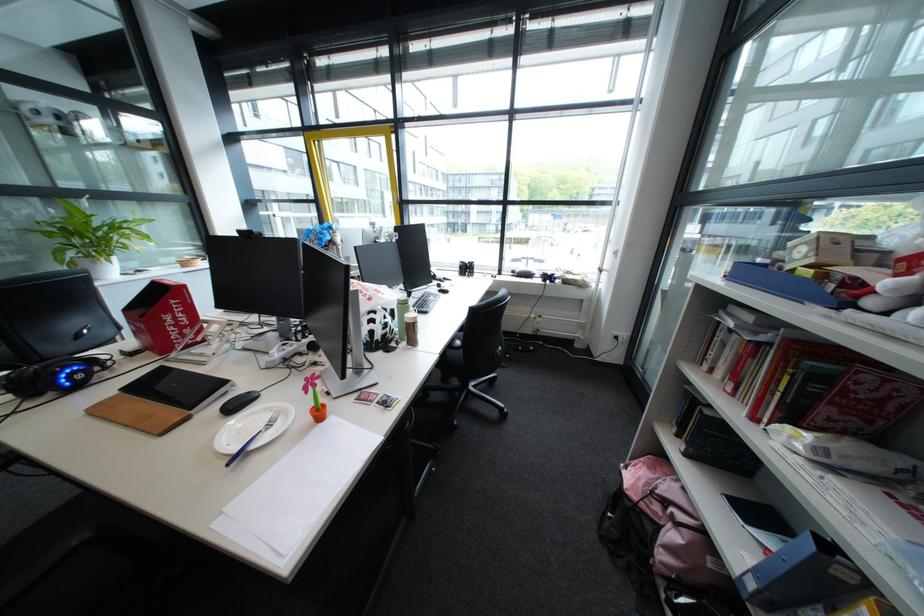
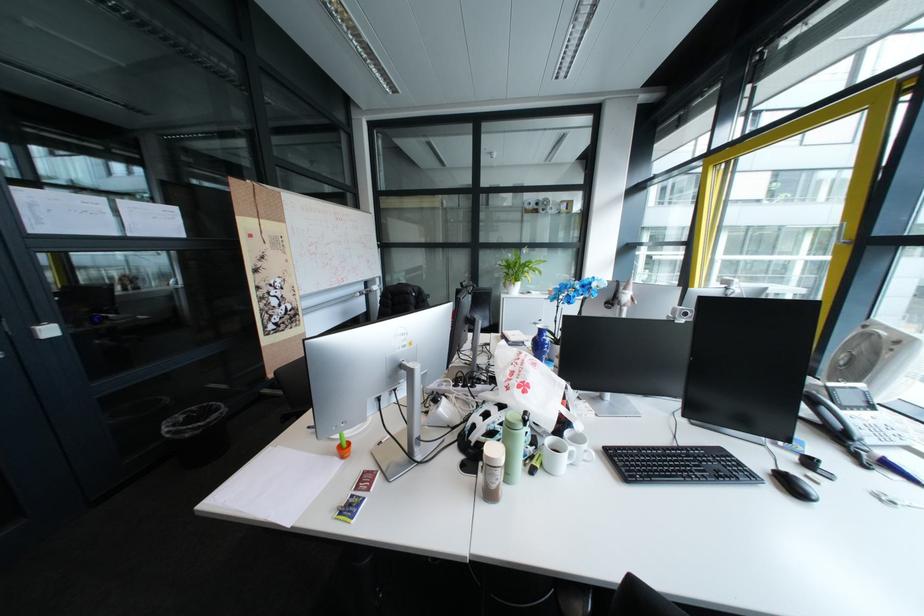
Where in the second image is the point corresponding to point 392,339 from the first image?

(484, 442)